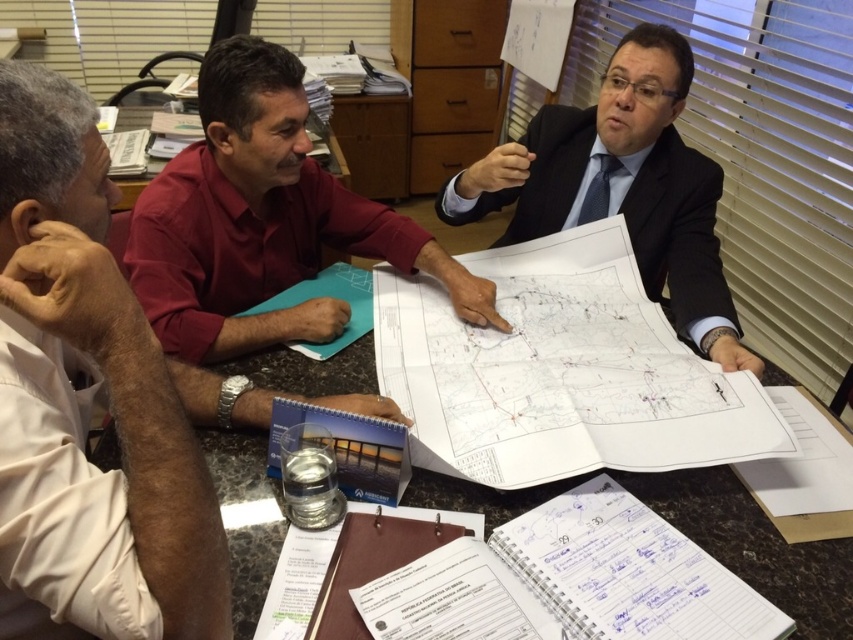
Can you confirm if dark suit at center is thinner than clear plastic water at lower center?

Yes, dark suit at center is thinner than clear plastic water at lower center.

The image size is (853, 640). In order to click on dark suit at center in this screenshot , I will do `click(621, 186)`.

The height and width of the screenshot is (640, 853). What do you see at coordinates (621, 186) in the screenshot? I see `dark suit at center` at bounding box center [621, 186].

The height and width of the screenshot is (640, 853). In order to click on dark suit at center in this screenshot , I will do `click(621, 186)`.

Is point (216, 144) closer to viewer compared to point (438, 481)?

No, it is behind (438, 481).

Image resolution: width=853 pixels, height=640 pixels. Describe the element at coordinates (262, 220) in the screenshot. I see `matte red shirt at center` at that location.

Who is more forward, (368,212) or (236,625)?

Positioned in front is point (236,625).

Find the location of a particular element. matte red shirt at center is located at coordinates (262, 220).

Is white paper at center wider than clear plastic water at lower center?

Incorrect, white paper at center's width does not surpass clear plastic water at lower center's.

At what (x,y) coordinates should I click in order to perform the action: click on white paper at center. Please return your answer as a coordinate pair (x, y). Looking at the image, I should click on (560, 371).